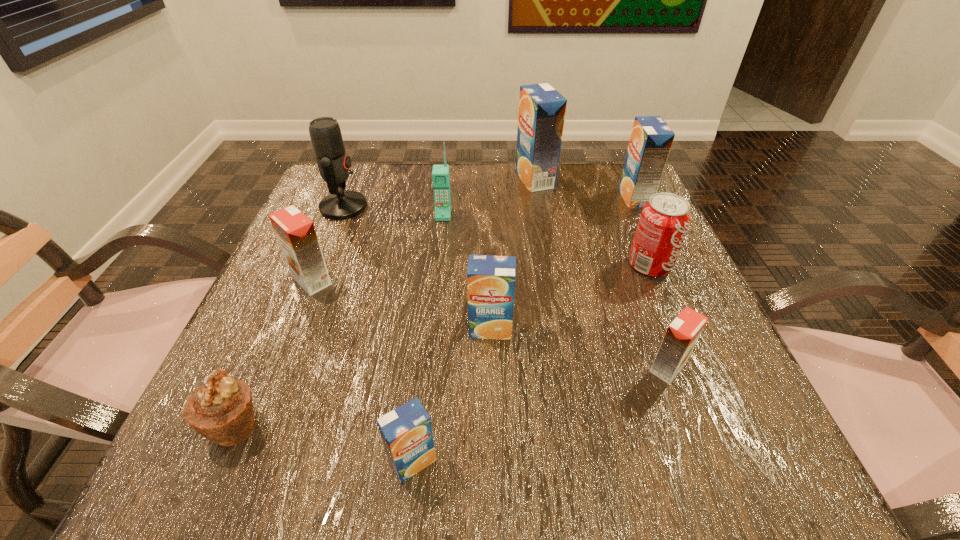
The height and width of the screenshot is (540, 960). Find the location of `free location at the right edge of the desktop`. free location at the right edge of the desktop is located at coordinates (698, 389).

What are the coordinates of `vacant space at the near left corner` in the screenshot? It's located at click(x=271, y=477).

Locate an element on the screen. The height and width of the screenshot is (540, 960). vacant area at the far right corner of the desktop is located at coordinates (586, 191).

Find the location of a particular element. free location at the near right corner of the desktop is located at coordinates pos(674,473).

In order to click on free space between the biggest blue orange_juice and the cellular telephone in this screenshot , I will do `click(489, 197)`.

At what (x,y) coordinates should I click in order to perform the action: click on free spot between the seventh object from left to right and the rightmost orange_juice. Please return your answer as a coordinate pair (x, y). The width and height of the screenshot is (960, 540). Looking at the image, I should click on (585, 188).

You are a GUI agent. You are given a task and a screenshot of the screen. Output one action in this format:
    pyautogui.click(x=<x>, y=<y>)
    Task: Click on the free space between the muffin and the nearest blue orange_juice
    The height and width of the screenshot is (540, 960).
    Given the screenshot: What is the action you would take?
    pyautogui.click(x=324, y=444)

Identify the location of blank region between the rightmost orange_juice and the fourth object from right to left. This screenshot has width=960, height=540. (585, 188).

The height and width of the screenshot is (540, 960). Find the location of `free space that is in between the muffin and the rightmost orange_juice`. free space that is in between the muffin and the rightmost orange_juice is located at coordinates (435, 312).

Identify the location of free space between the third biggest blue orange_juice and the rightmost orange_juice. This screenshot has width=960, height=540. point(563,263).